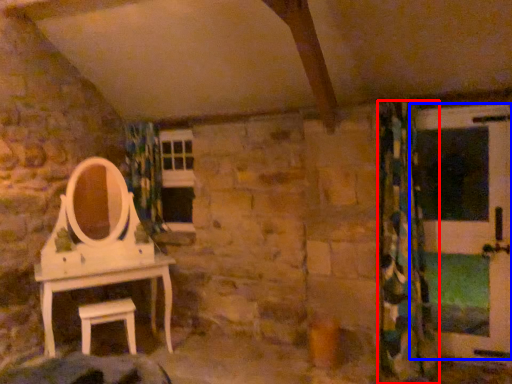
Question: Which of the following is the farthest to the observer, curtain (highlighted by a red box) or screen door (highlighted by a blue box)?

Choices:
 (A) curtain
 (B) screen door

Answer: (B)